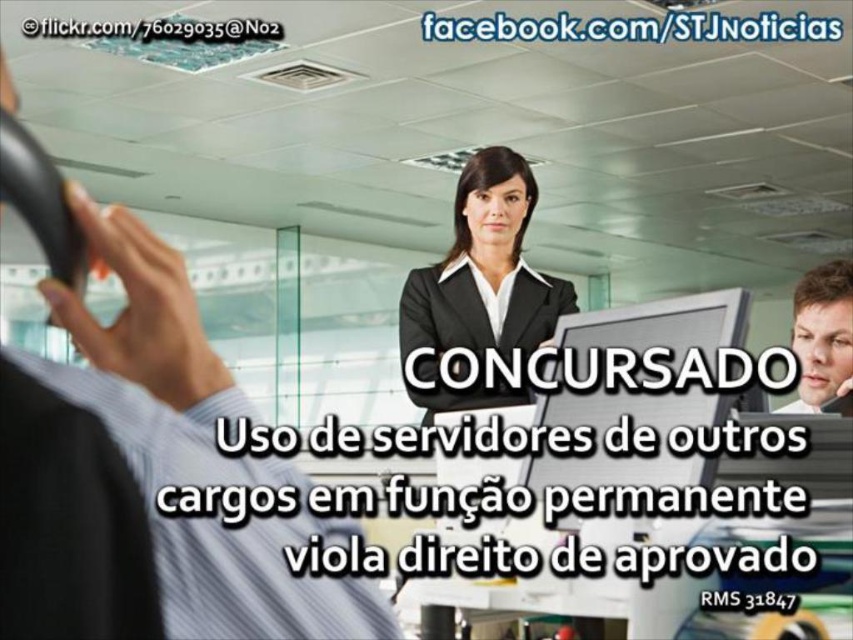
Question: Does black matte suit at center have a larger size compared to smooth skin face at center?

Choices:
 (A) yes
 (B) no

Answer: (A)

Question: Which object is positioned closest to the black matte suit at center?

Choices:
 (A) smooth skin face at center
 (B) matte black monitor at center

Answer: (B)

Question: Which point is closer to the camera?

Choices:
 (A) (837, 339)
 (B) (596, 451)
 (C) (424, 323)

Answer: (B)

Question: Estimate the real-world distances between objects in this image. Which object is closer to the smooth skin face at center?

Choices:
 (A) matte black monitor at center
 (B) black matte suit at center

Answer: (A)

Question: In this image, where is black matte suit at center located relative to matte black monitor at center?

Choices:
 (A) below
 (B) above

Answer: (B)

Question: Is matte black monitor at center positioned behind smooth skin face at center?

Choices:
 (A) no
 (B) yes

Answer: (A)